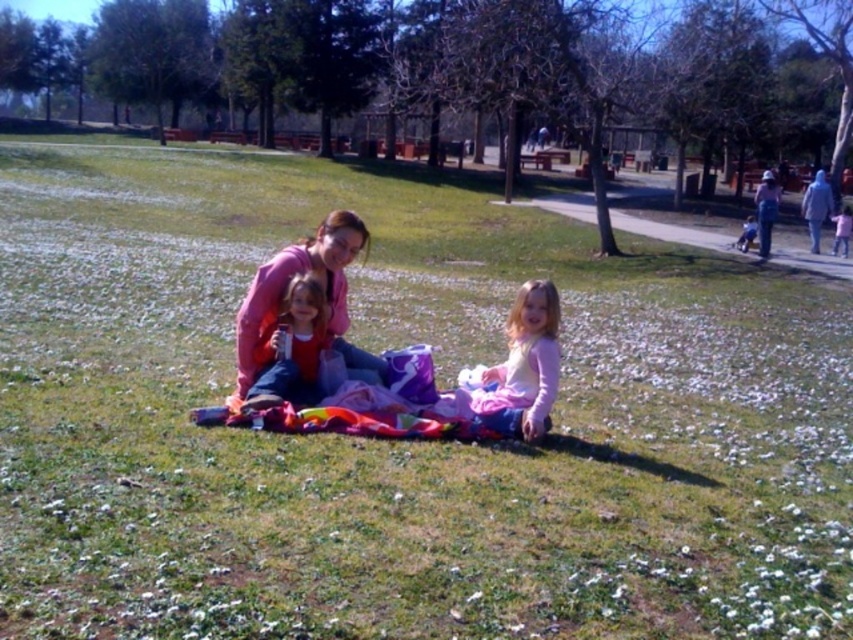
Where is `denim jacket at right`? denim jacket at right is located at coordinates (766, 211).

Who is positioned more to the right, denim jacket at right or pink fabric at lower right?

denim jacket at right is more to the right.

At what (x,y) coordinates should I click in order to perform the action: click on denim jacket at right. Please return your answer as a coordinate pair (x, y). The height and width of the screenshot is (640, 853). Looking at the image, I should click on (766, 211).

Does pink fleece jacket at center have a greater height compared to light pink fabric at lower right?

Indeed, pink fleece jacket at center has a greater height compared to light pink fabric at lower right.

Can you confirm if pink fleece jacket at center is wider than light pink fabric at lower right?

Correct, the width of pink fleece jacket at center exceeds that of light pink fabric at lower right.

Is point (247, 292) more distant than point (746, 234)?

No, it is in front of (746, 234).

Find the location of a particular element. This screenshot has height=640, width=853. pink fleece jacket at center is located at coordinates (288, 280).

Is pink fleece jacket at center smaller than denim jacket at right?

Yes.

Is pink fleece jacket at center above denim jacket at right?

Actually, pink fleece jacket at center is below denim jacket at right.

Where is `pink fleece jacket at center`? pink fleece jacket at center is located at coordinates (288, 280).